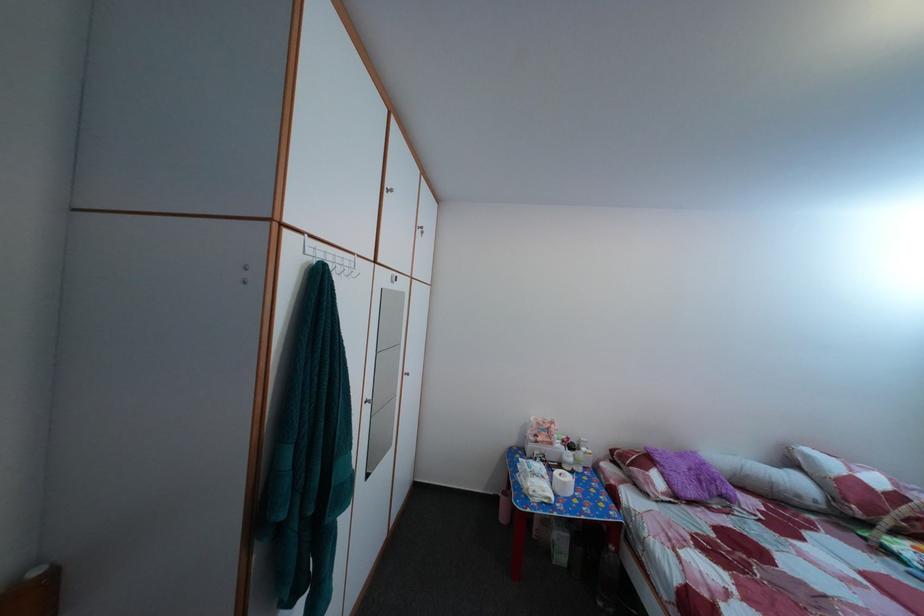
Find where to hang the white wall hook. Please return your answer as a coordinate pair (x, y).

(332, 259)